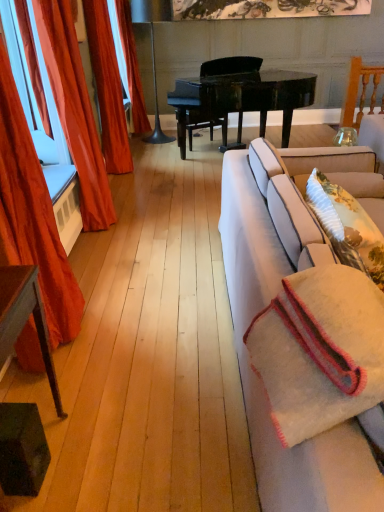
Question: Is velvet orange curtain at left, placed as the second curtain when sorted from front to back, situated inside shiny orange curtain at left, marked as the third curtain in a front-to-back arrangement, or outside?

Choices:
 (A) outside
 (B) inside

Answer: (A)

Question: From the image's perspective, is velvet orange curtain at left, which appears as the third curtain when viewed from the back, positioned above or below shiny orange curtain at left, arranged as the 2th curtain when viewed from the back?

Choices:
 (A) above
 (B) below

Answer: (B)

Question: Which object is the farthest from the velvet orange curtain at left, which is the 1th curtain from front to back?

Choices:
 (A) white woven blanket at right
 (B) shiny orange curtain at left, marked as the third curtain in a front-to-back arrangement
 (C) black glossy piano at center
 (D) orange fabric curtain at left, the 1th curtain positioned from the back
 (E) green painted wood side table at lower left

Answer: (D)

Question: Estimate the real-world distances between objects in this image. Which object is farther from the fluffy beige pillow at right?

Choices:
 (A) velvet orange curtain at left, which is the 1th curtain from front to back
 (B) shiny orange curtain at left, marked as the third curtain in a front-to-back arrangement
 (C) velvet orange curtain at left, placed as the second curtain when sorted from front to back
 (D) white fabric couch at right
 (E) green painted wood side table at lower left

Answer: (B)